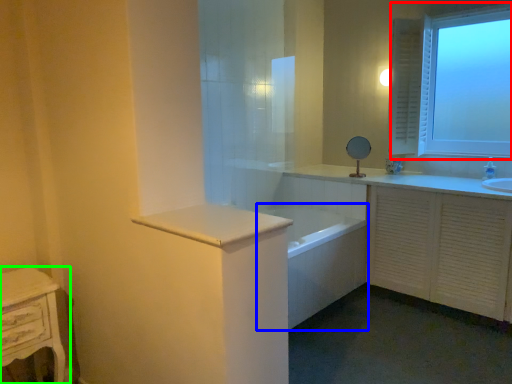
Question: Considering the real-world distances, which object is farthest from window (highlighted by a red box)? bath (highlighted by a blue box) or nightstand (highlighted by a green box)?

Choices:
 (A) bath
 (B) nightstand

Answer: (B)